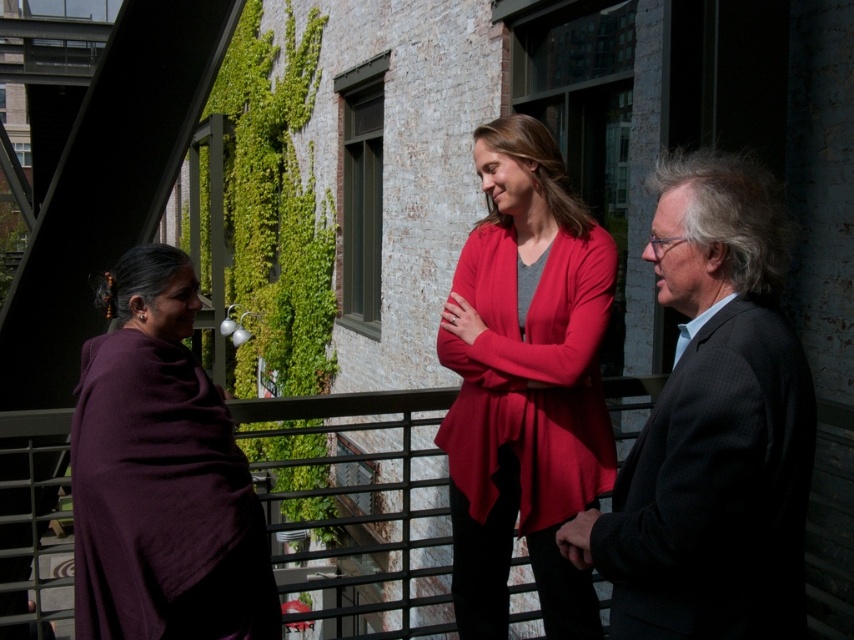
Question: Is dark gray suit at right to the left of matte red cardigan at center from the viewer's perspective?

Choices:
 (A) yes
 (B) no

Answer: (B)

Question: Which object is the closest to the dark gray suit at right?

Choices:
 (A) purple woolen shawl at left
 (B) matte red cardigan at center

Answer: (B)

Question: Which of the following is the farthest from the observer?

Choices:
 (A) dark gray suit at right
 (B) matte red cardigan at center
 (C) purple woolen shawl at left

Answer: (B)

Question: Which object is farther from the camera taking this photo?

Choices:
 (A) purple woolen shawl at left
 (B) matte red cardigan at center
 (C) dark gray suit at right

Answer: (B)

Question: Observing the image, what is the correct spatial positioning of matte red cardigan at center in reference to purple woolen shawl at left?

Choices:
 (A) below
 (B) above

Answer: (B)

Question: Can you confirm if matte red cardigan at center is positioned below purple woolen shawl at left?

Choices:
 (A) no
 (B) yes

Answer: (A)